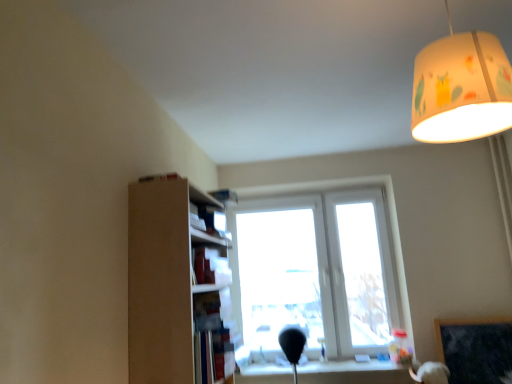
Question: Considering the relative sizes of brown cardboard shelf at left and hardcover book at upper center in the image provided, is brown cardboard shelf at left shorter than hardcover book at upper center?

Choices:
 (A) yes
 (B) no

Answer: (B)

Question: Considering the relative sizes of brown cardboard shelf at left and hardcover book at upper center in the image provided, is brown cardboard shelf at left bigger than hardcover book at upper center?

Choices:
 (A) no
 (B) yes

Answer: (B)

Question: Is the position of brown cardboard shelf at left less distant than that of hardcover book at upper center?

Choices:
 (A) no
 (B) yes

Answer: (B)

Question: From a real-world perspective, does brown cardboard shelf at left stand above hardcover book at upper center?

Choices:
 (A) yes
 (B) no

Answer: (B)

Question: Can you confirm if brown cardboard shelf at left is wider than hardcover book at upper center?

Choices:
 (A) yes
 (B) no

Answer: (A)

Question: In the image, is brown cardboard shelf at left positioned in front of or behind transparent glass window at center?

Choices:
 (A) front
 (B) behind

Answer: (A)

Question: Considering the positions of brown cardboard shelf at left and transparent glass window at center in the image, is brown cardboard shelf at left bigger or smaller than transparent glass window at center?

Choices:
 (A) small
 (B) big

Answer: (A)

Question: From the image's perspective, is brown cardboard shelf at left positioned above or below transparent glass window at center?

Choices:
 (A) above
 (B) below

Answer: (A)

Question: Is brown cardboard shelf at left inside the boundaries of transparent glass window at center, or outside?

Choices:
 (A) inside
 (B) outside

Answer: (B)

Question: Considering the positions of point (384, 271) and point (225, 233), is point (384, 271) closer or farther from the camera than point (225, 233)?

Choices:
 (A) farther
 (B) closer

Answer: (A)

Question: From the image's perspective, is transparent glass window at center positioned above or below hardcover book at upper center?

Choices:
 (A) below
 (B) above

Answer: (A)

Question: Is transparent glass window at center to the left or to the right of hardcover book at upper center in the image?

Choices:
 (A) left
 (B) right

Answer: (B)

Question: Relative to hardcover book at upper center, is transparent glass window at center in front or behind?

Choices:
 (A) front
 (B) behind

Answer: (B)

Question: In the image, is transparent glass window at center positioned in front of or behind brown cardboard shelf at left?

Choices:
 (A) behind
 (B) front

Answer: (A)

Question: From the image's perspective, is transparent glass window at center above or below brown cardboard shelf at left?

Choices:
 (A) above
 (B) below

Answer: (B)